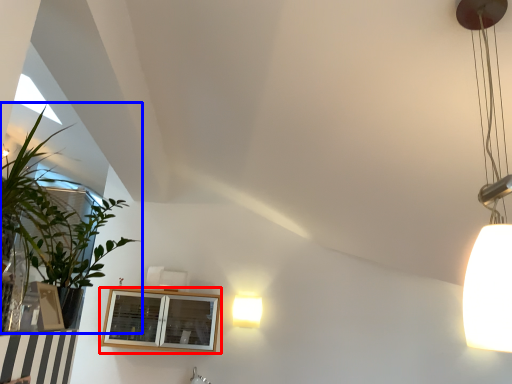
Question: Which of the following is the farthest to the observer, window (highlighted by a red box) or houseplant (highlighted by a blue box)?

Choices:
 (A) window
 (B) houseplant

Answer: (A)